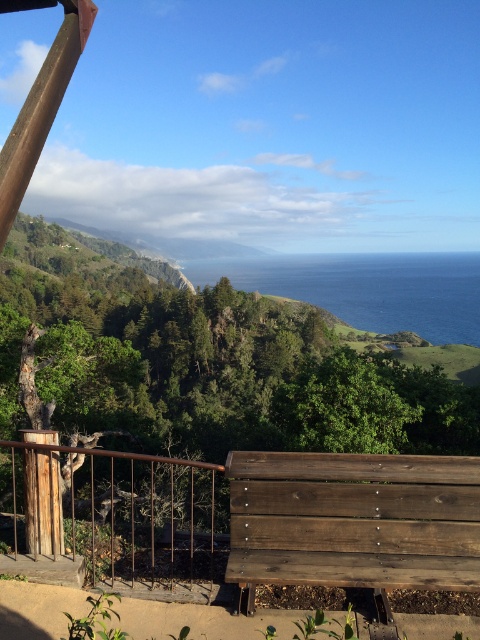
Question: Is rusty metal rail at lower left to the left of blue water at center from the viewer's perspective?

Choices:
 (A) no
 (B) yes

Answer: (B)

Question: Estimate the real-world distances between objects in this image. Which object is farther from the rusty metal rail at lower left?

Choices:
 (A) dark brown wooden bench at lower center
 (B) blue water at center

Answer: (B)

Question: Which object appears closest to the camera in this image?

Choices:
 (A) rusty metal rail at lower left
 (B) blue water at center
 (C) dark brown wooden bench at lower center

Answer: (C)

Question: Does dark brown wooden bench at lower center have a smaller size compared to blue water at center?

Choices:
 (A) no
 (B) yes

Answer: (B)

Question: Which object is positioned farthest from the dark brown wooden bench at lower center?

Choices:
 (A) rusty metal rail at lower left
 (B) blue water at center

Answer: (B)

Question: Is the position of rusty metal rail at lower left less distant than that of blue water at center?

Choices:
 (A) no
 (B) yes

Answer: (B)